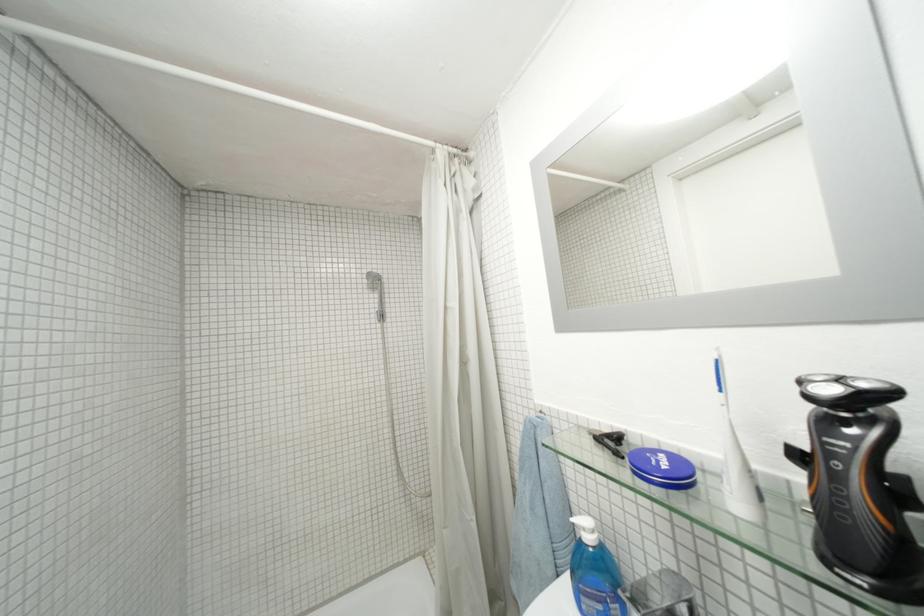
Locate an element on the screen. white electric toothbrush is located at coordinates (736, 461).